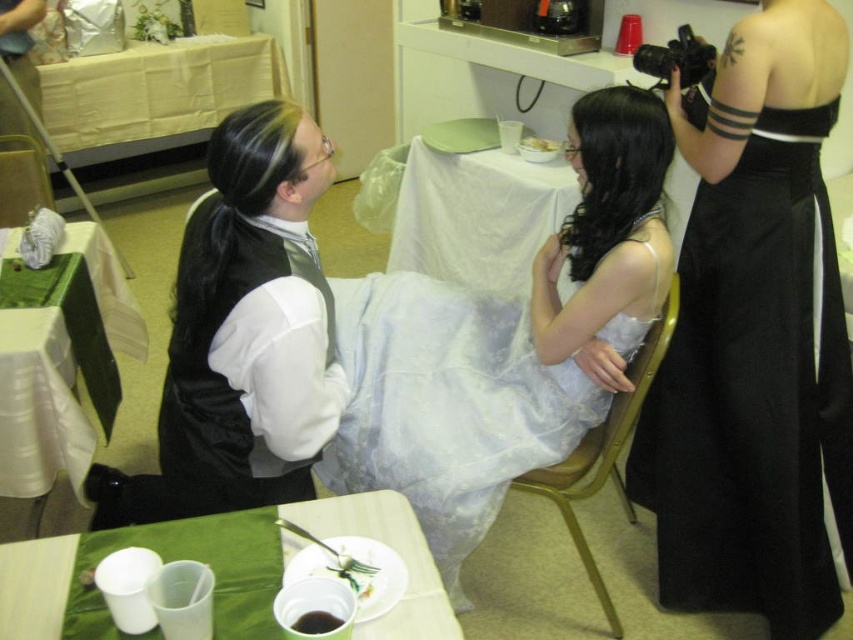
Question: Considering the relative positions of green fabric table at lower left and white plastic cups at lower left in the image provided, where is green fabric table at lower left located with respect to white plastic cups at lower left?

Choices:
 (A) right
 (B) left

Answer: (B)

Question: Which of these objects is positioned closest to the white cloth table at center?

Choices:
 (A) white plastic cups at lower left
 (B) black satin dress at right
 (C) metallic gold chair at center
 (D) velvet black vest at left

Answer: (B)

Question: Does black satin dress at right have a greater width compared to metallic gold chair at center?

Choices:
 (A) yes
 (B) no

Answer: (A)

Question: Can you confirm if green fabric table at lower left is positioned above white cloth table at center?

Choices:
 (A) no
 (B) yes

Answer: (A)

Question: Which point is farther from the camera taking this photo?

Choices:
 (A) (415, 152)
 (B) (708, 480)
 (C) (445, 612)
 (D) (627, 516)

Answer: (A)

Question: Which of the following is the farthest from the observer?

Choices:
 (A) (606, 442)
 (B) (497, 211)
 (C) (697, 529)
 (D) (111, 282)

Answer: (B)